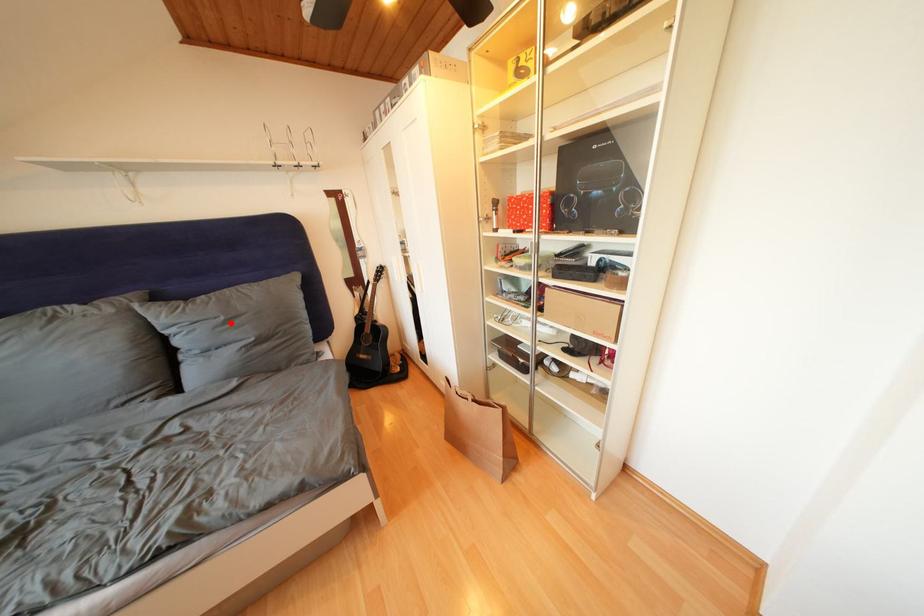
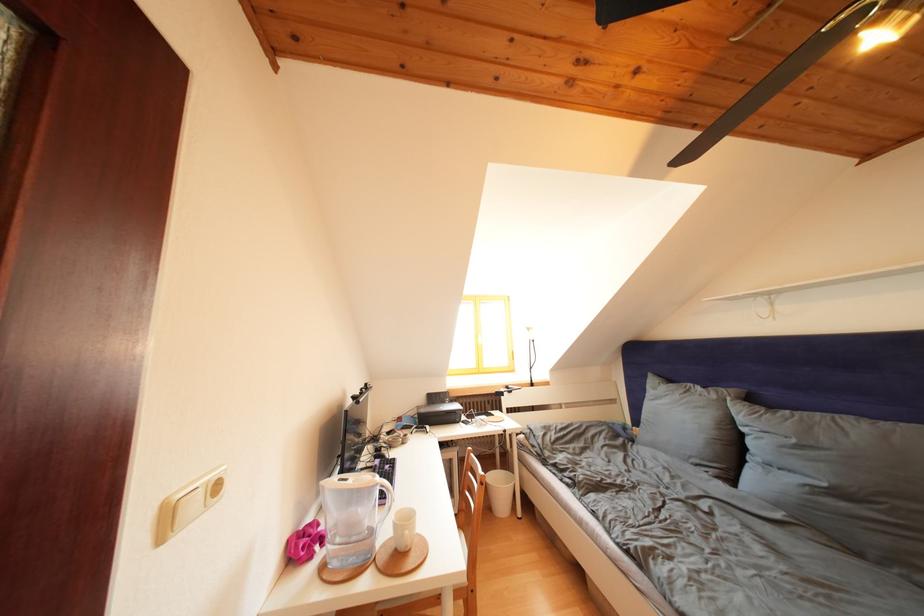
In the second image, find the point that corresponds to the highlighted location in the first image.

(801, 446)